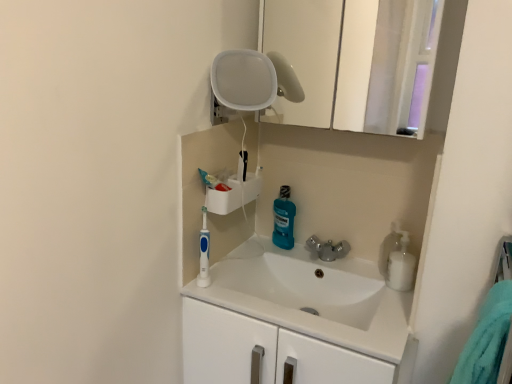
Identify the location of vacant region in front of blue glossy mouthwash at center, acting as the 1th cleaning product starting from the back. (286, 260).